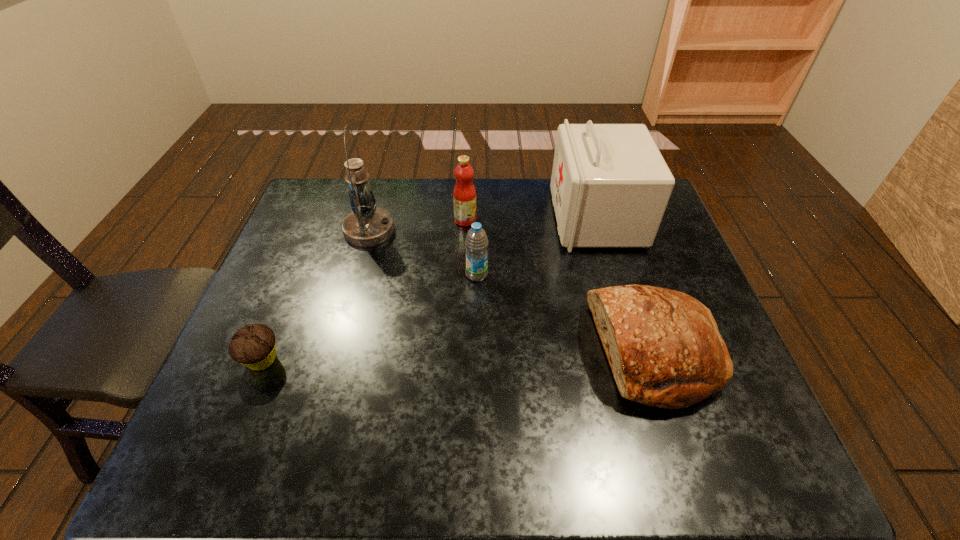
This screenshot has width=960, height=540. What are the coordinates of `oil lamp` in the screenshot? It's located at (367, 225).

You are a GUI agent. You are given a task and a screenshot of the screen. Output one action in this format:
    pyautogui.click(x=<x>, y=<y>)
    Task: Click on the first-aid kit
    The height and width of the screenshot is (540, 960).
    Given the screenshot: What is the action you would take?
    pyautogui.click(x=610, y=186)

You are a GUI agent. You are given a task and a screenshot of the screen. Output one action in this format:
    pyautogui.click(x=<x>, y=<y>)
    Task: Click on the fruit juice
    
    Given the screenshot: What is the action you would take?
    pyautogui.click(x=464, y=194)

Where is `the fourth farthest object`? The height and width of the screenshot is (540, 960). the fourth farthest object is located at coordinates (476, 243).

Find the location of a particular element. The width and height of the screenshot is (960, 540). bread is located at coordinates (663, 346).

Where is `the leftmost object`? The width and height of the screenshot is (960, 540). the leftmost object is located at coordinates (253, 346).

You are a GUI agent. You are given a task and a screenshot of the screen. Output one action in this format:
    pyautogui.click(x=<x>, y=<y>)
    Task: Click on the muffin
    
    Given the screenshot: What is the action you would take?
    pyautogui.click(x=253, y=346)

Locate an element on the screen. The width and height of the screenshot is (960, 540). vacant space located 0.120m on the front of the oil lamp is located at coordinates (356, 276).

Locate an element on the screen. free space located 0.110m on the front-facing side of the first-aid kit is located at coordinates (519, 218).

At what (x,y) coordinates should I click in order to perform the action: click on free space located 0.200m on the front-facing side of the first-aid kit. Please return your answer as a coordinate pair (x, y). This screenshot has height=540, width=960. Looking at the image, I should click on (491, 218).